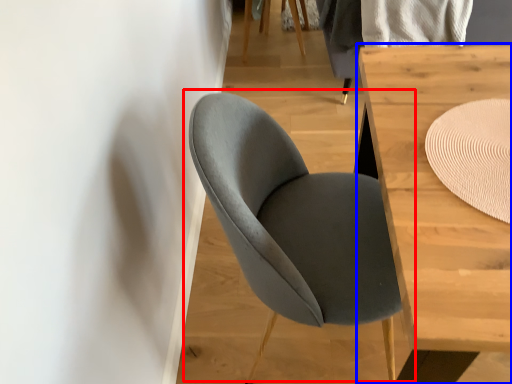
Question: Which point is further to the camera, chair (highlighted by a red box) or table (highlighted by a blue box)?

Choices:
 (A) chair
 (B) table

Answer: (A)